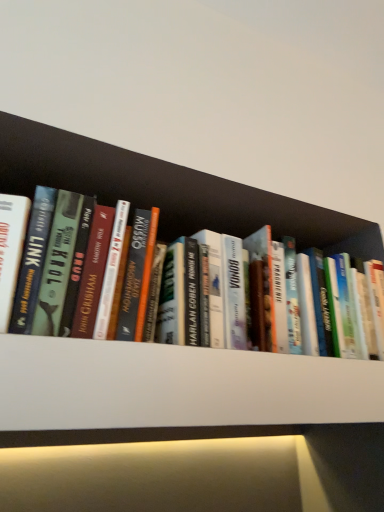
Question: Would you say hardcover book at center is inside or outside white matte shelf at center?

Choices:
 (A) inside
 (B) outside

Answer: (B)

Question: In the image, is hardcover book at center on the left side or the right side of white matte shelf at center?

Choices:
 (A) right
 (B) left

Answer: (A)

Question: Does point (84, 308) appear closer or farther from the camera than point (196, 391)?

Choices:
 (A) farther
 (B) closer

Answer: (B)

Question: From the image's perspective, is white matte shelf at center above or below hardcover book at center?

Choices:
 (A) above
 (B) below

Answer: (B)

Question: In terms of width, does white matte shelf at center look wider or thinner when compared to hardcover book at center?

Choices:
 (A) wide
 (B) thin

Answer: (A)

Question: Considering their positions, is white matte shelf at center located in front of or behind hardcover book at center?

Choices:
 (A) behind
 (B) front

Answer: (B)

Question: Would you say white matte shelf at center is to the left or to the right of hardcover book at center in the picture?

Choices:
 (A) right
 (B) left

Answer: (B)